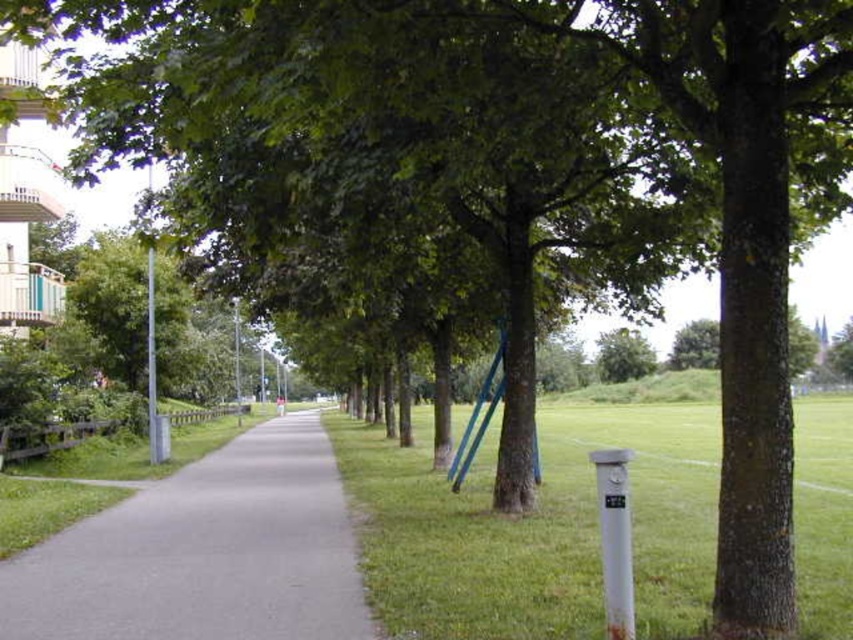
Is gray asphalt path at center taller than green leafy tree at center?

No, gray asphalt path at center is not taller than green leafy tree at center.

Between gray asphalt path at center and green leafy tree at center, which one is positioned lower?

gray asphalt path at center is lower down.

What are the coordinates of `gray asphalt path at center` in the screenshot? It's located at (206, 552).

Where is `gray asphalt path at center`? gray asphalt path at center is located at coordinates (206, 552).

Between green grass at center and green leafy tree at center, which one is positioned higher?

green leafy tree at center

Image resolution: width=853 pixels, height=640 pixels. What do you see at coordinates (535, 528) in the screenshot?
I see `green grass at center` at bounding box center [535, 528].

Which is behind, point (576, 445) or point (643, 364)?

Point (643, 364)

Image resolution: width=853 pixels, height=640 pixels. In order to click on green grass at center in this screenshot , I will do `click(535, 528)`.

Which is behind, point (387, 486) or point (283, 509)?

The point (387, 486) is more distant.

Which is behind, point (809, 486) or point (41, 570)?

Positioned behind is point (809, 486).

Locate an element on the screen. Image resolution: width=853 pixels, height=640 pixels. green grass at center is located at coordinates (535, 528).